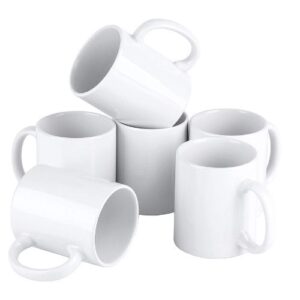
The width and height of the screenshot is (300, 300). I want to click on side of mug, so click(x=64, y=206), click(x=92, y=157), click(x=206, y=194), click(x=257, y=142), click(x=147, y=167), click(x=151, y=91).